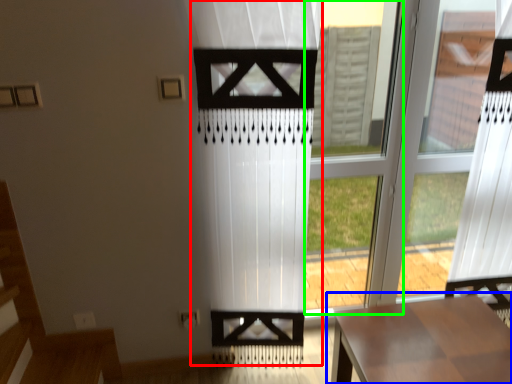
Question: Considering the real-world distances, which object is closest to curtain (highlighted by a red box)? table (highlighted by a blue box) or window frame (highlighted by a green box).

Choices:
 (A) table
 (B) window frame

Answer: (A)